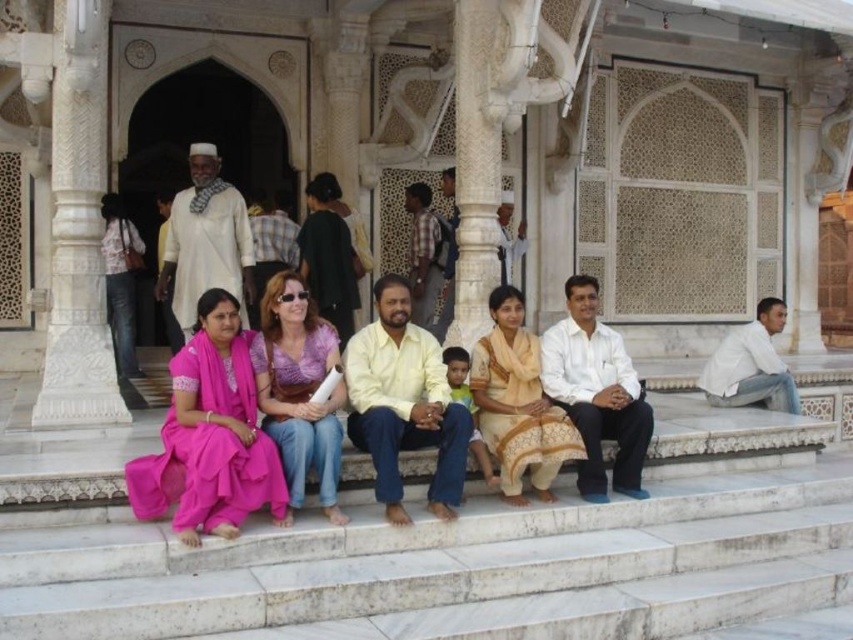
Is point (85, 412) in front of point (521, 445)?

No.

Measure the distance from white marble pillar at left to beige cotton saree at center.

white marble pillar at left is 54.93 feet away from beige cotton saree at center.

Does point (62, 276) come closer to viewer compared to point (502, 333)?

Yes, point (62, 276) is closer to viewer.

The image size is (853, 640). Find the location of `white marble pillar at left`. white marble pillar at left is located at coordinates (78, 227).

Between point (285, 284) and point (494, 307), which one is positioned in front?

Positioned in front is point (285, 284).

Image resolution: width=853 pixels, height=640 pixels. Find the location of `purple fabric dress at center`. purple fabric dress at center is located at coordinates (299, 388).

Does point (277, 301) come behind point (500, 486)?

No, (277, 301) is closer to viewer.

At what (x,y) coordinates should I click in order to perform the action: click on purple fabric dress at center. Please return your answer as a coordinate pair (x, y). Image resolution: width=853 pixels, height=640 pixels. Looking at the image, I should click on (299, 388).

Who is higher up, yellow matte shirt at center or beige cotton saree at center?

yellow matte shirt at center

Is point (373, 419) closer to viewer compared to point (496, 420)?

Yes.

Where is `yellow matte shirt at center`? The width and height of the screenshot is (853, 640). yellow matte shirt at center is located at coordinates (403, 403).